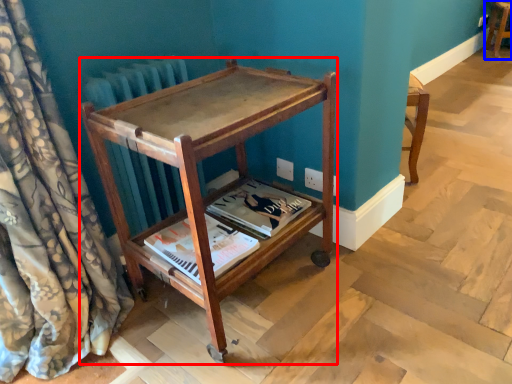
Question: Which point is closer to the camera, furniture (highlighted by a red box) or furniture (highlighted by a blue box)?

Choices:
 (A) furniture
 (B) furniture

Answer: (A)